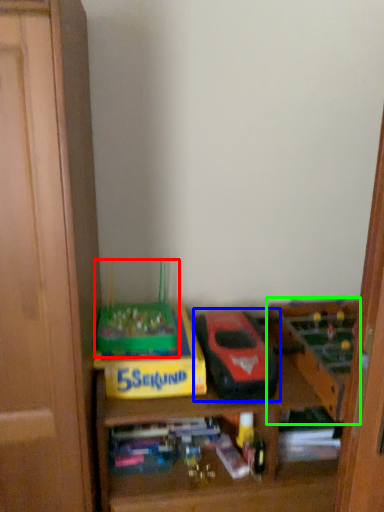
Question: Which object is the farthest from toy (highlighted by a red box)? Choose among these: model car (highlighted by a blue box) or toy (highlighted by a green box).

Choices:
 (A) model car
 (B) toy

Answer: (B)